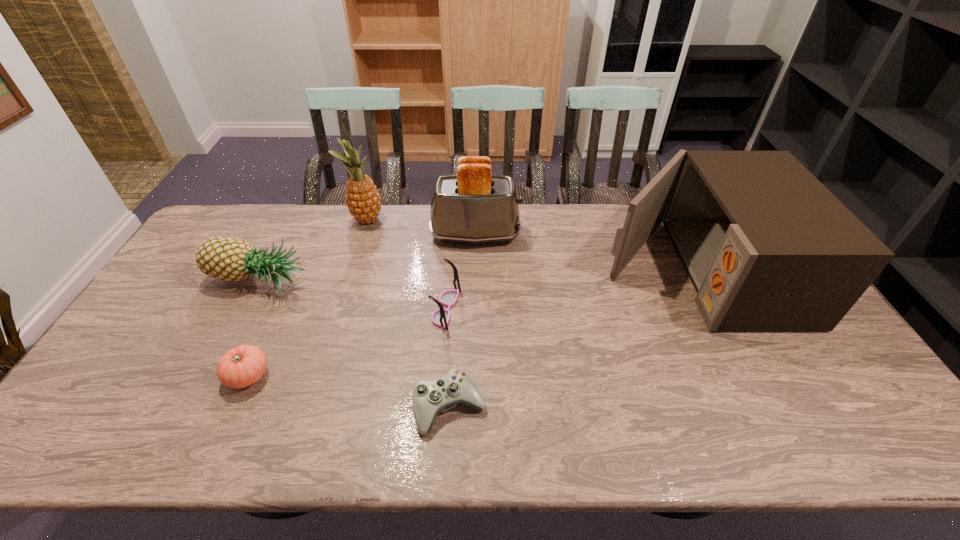
I want to click on vacant region located on the side of the toaster with the control lever, so click(550, 235).

Where is `vacant region located with the door open on the front of the microwave oven`? The image size is (960, 540). vacant region located with the door open on the front of the microwave oven is located at coordinates (483, 271).

Find the location of a particular element. The height and width of the screenshot is (540, 960). vacant space situated with the door open on the front of the microwave oven is located at coordinates (495, 271).

I want to click on free location located 0.110m with the door open on the front of the microwave oven, so click(567, 271).

At what (x,y) coordinates should I click in order to perform the action: click on free space located on the back of the left pineapple. Please return your answer as a coordinate pair (x, y). Looking at the image, I should click on (283, 234).

This screenshot has height=540, width=960. I want to click on free spot located 0.110m on the front of the spectacles, so click(x=443, y=363).

You are a GUI agent. You are given a task and a screenshot of the screen. Output one action in this format:
    pyautogui.click(x=<x>, y=<y>)
    Task: Click on the free space located 0.340m on the right of the tomato
    The image size is (960, 540).
    Given the screenshot: What is the action you would take?
    pyautogui.click(x=404, y=376)

The width and height of the screenshot is (960, 540). I want to click on vacant space located 0.090m on the back of the control, so click(x=453, y=350).

The height and width of the screenshot is (540, 960). I want to click on pineapple that is at the far edge, so click(x=363, y=200).

You are a GUI agent. You are given a task and a screenshot of the screen. Output one action in this format:
    pyautogui.click(x=<x>, y=<y>)
    Task: Click on the toaster situated at the far edge
    The height and width of the screenshot is (540, 960).
    Given the screenshot: What is the action you would take?
    pyautogui.click(x=473, y=206)